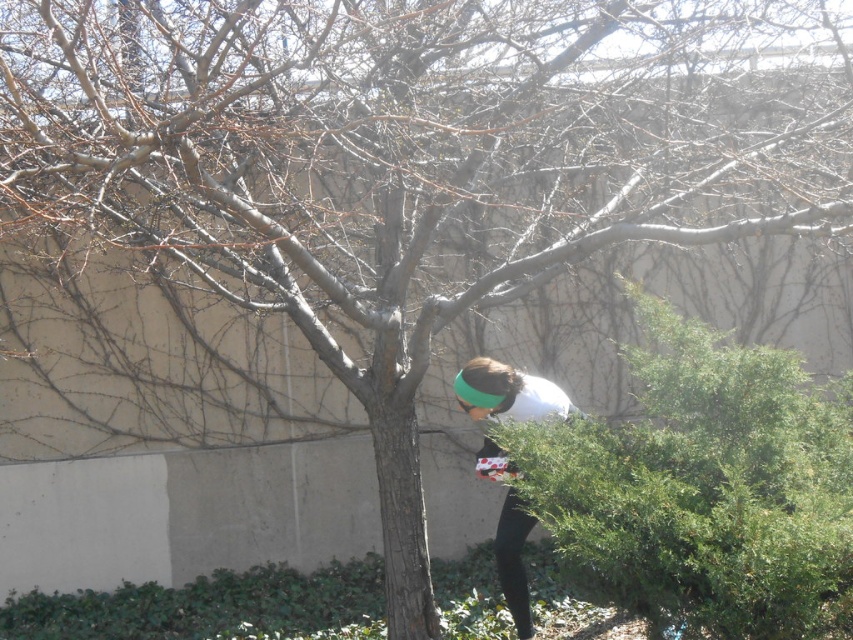
Question: Which point is farther to the camera?

Choices:
 (A) white fabric at center
 (B) black matte leggings at lower center

Answer: (B)

Question: Is white fabric at center to the left of black matte leggings at lower center from the viewer's perspective?

Choices:
 (A) no
 (B) yes

Answer: (A)

Question: Does green leafy hedge at lower right have a larger size compared to white fabric at center?

Choices:
 (A) no
 (B) yes

Answer: (B)

Question: Which point appears farthest from the camera in this image?

Choices:
 (A) (498, 572)
 (B) (663, 609)

Answer: (A)

Question: Does white fabric at center lie in front of black matte leggings at lower center?

Choices:
 (A) yes
 (B) no

Answer: (A)

Question: Which object is positioned farthest from the green leafy hedge at lower right?

Choices:
 (A) white fabric at center
 (B) black matte leggings at lower center

Answer: (B)